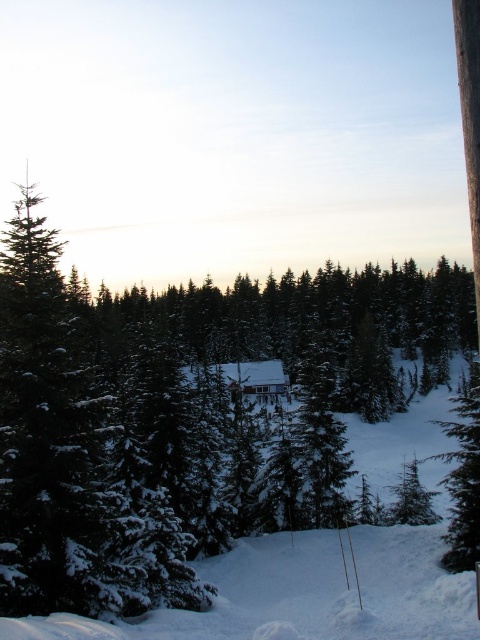
Which of these two, white snow ski slope at lower center or wooden cabin at center, stands taller?

Standing taller between the two is white snow ski slope at lower center.

Which is more to the left, white snow ski slope at lower center or wooden cabin at center?

wooden cabin at center

This screenshot has width=480, height=640. Describe the element at coordinates (304, 593) in the screenshot. I see `white snow ski slope at lower center` at that location.

The image size is (480, 640). Identify the location of white snow ski slope at lower center. (304, 593).